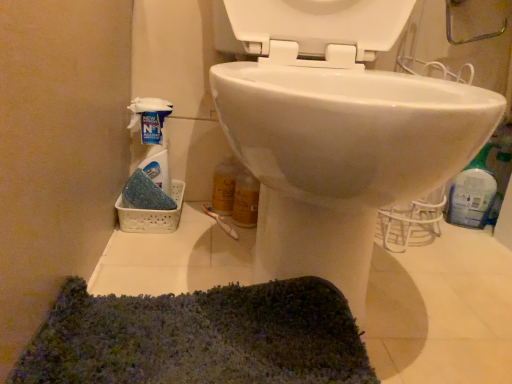
Where is `vacant space that is to the left of blue plastic bottle at right, which appears as the second cleaning product when viewed from the left`? The width and height of the screenshot is (512, 384). vacant space that is to the left of blue plastic bottle at right, which appears as the second cleaning product when viewed from the left is located at coordinates (423, 227).